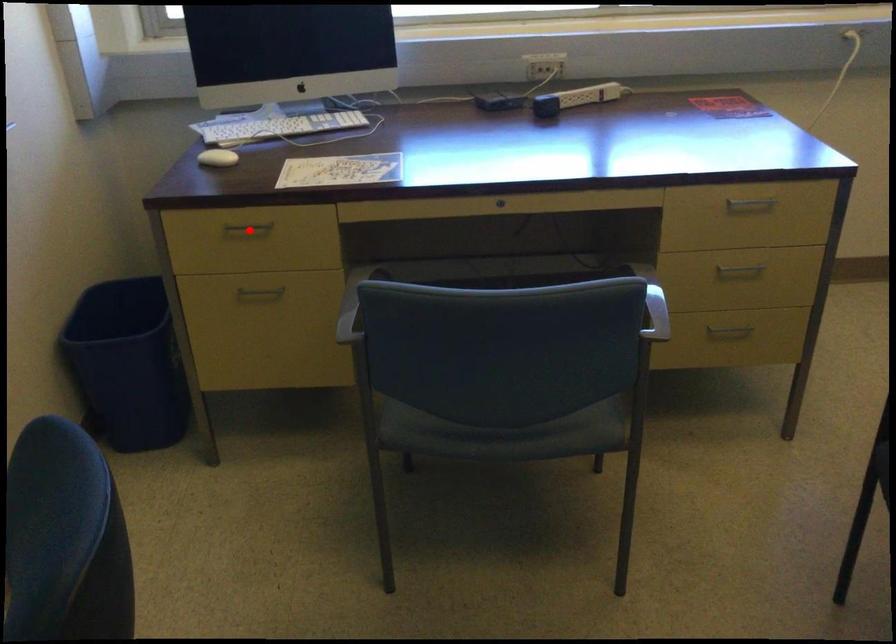
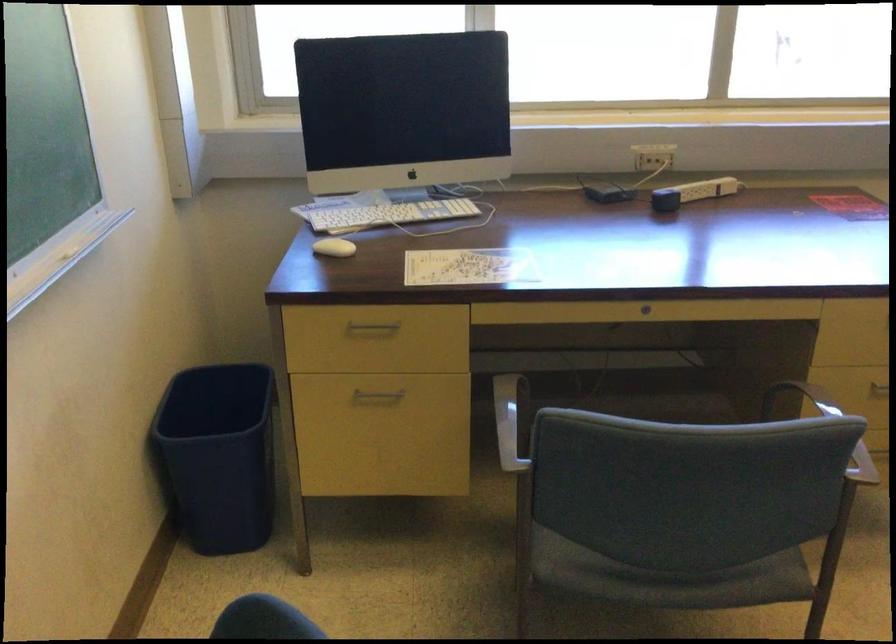
Locate, in the second image, the point that corresponds to the highlighted location in the first image.

(373, 327)